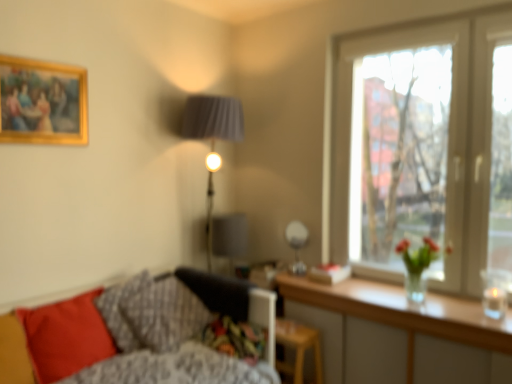
Question: Is wooden stool at lower center situated inside textured gray pillow at lower left, the 2th pillow when ordered from left to right, or outside?

Choices:
 (A) outside
 (B) inside

Answer: (A)

Question: From a real-world perspective, relative to textured gray pillow at lower left, which ranks as the second pillow in right-to-left order, is wooden stool at lower center vertically above or below?

Choices:
 (A) below
 (B) above

Answer: (A)

Question: Considering the real-world distances, which object is closest to the matte red pillow at lower left, arranged as the first pillow when viewed from the left?

Choices:
 (A) textured gray pillow at lower left, which ranks as the second pillow in right-to-left order
 (B) clear wood table at lower right
 (C) fluffy gray pillow at lower left, the first pillow positioned from the right
 (D) transparent glass window at upper right
 (E) gold-framed painting at upper left

Answer: (A)

Question: Considering the real-world distances, which object is farthest from the translucent glass candle at lower right?

Choices:
 (A) transparent glass window at upper right
 (B) clear wood table at lower right
 (C) textured gray pillow at lower left, the 2th pillow when ordered from left to right
 (D) fluffy gray pillow at lower left, the first pillow positioned from the right
 (E) wooden stool at lower center

Answer: (C)